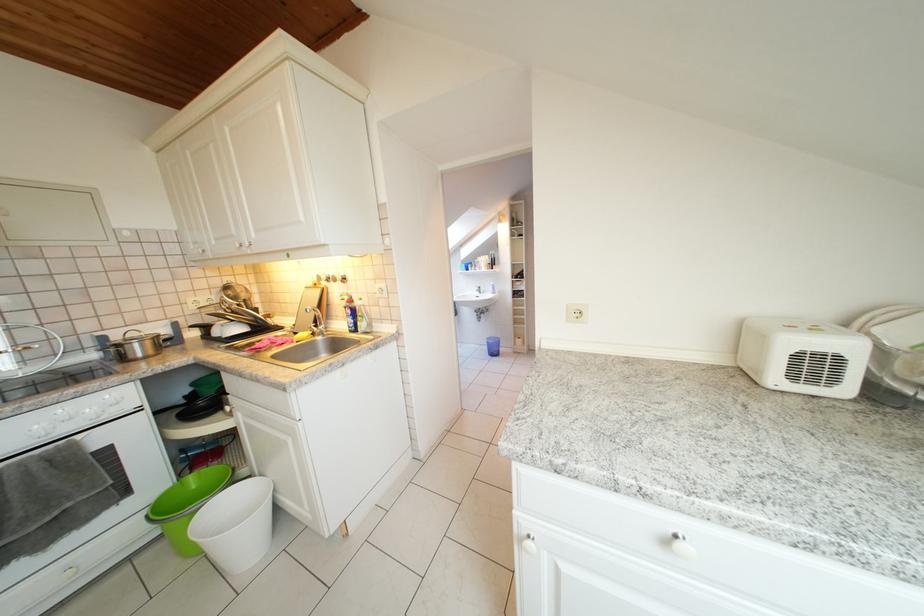
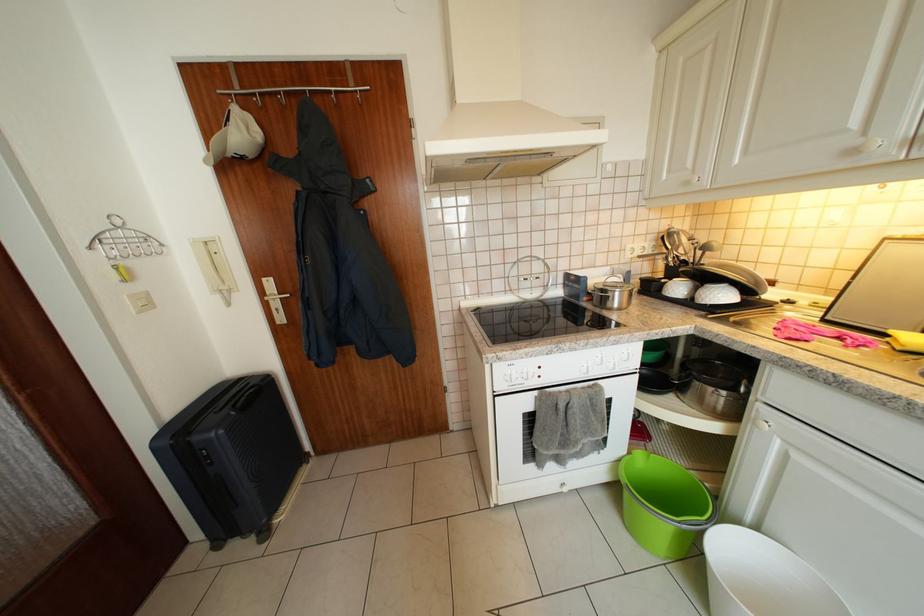
Where in the second image is the point corresponding to (x=146, y=351) from the first image?

(626, 299)